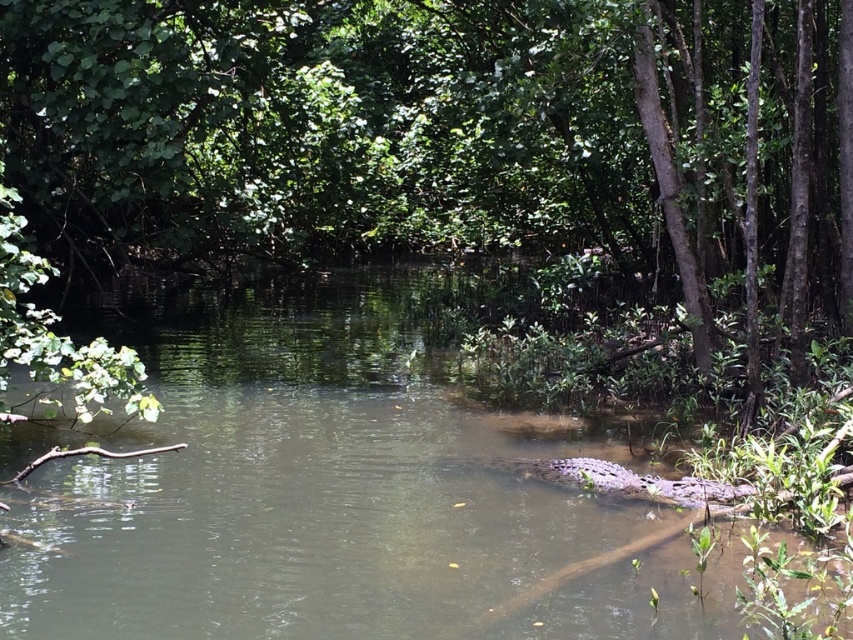
You are a bird flying over the swamp. You see the green leafy tree at center and the brown muddy stream at center. Which one is higher in the air?

The green leafy tree at center is higher in the air than the brown muddy stream at center because the tree is positioned above the stream in the scene.

You are standing in a swampy area and see a green leafy tree at center. You want to throw a stone to hit the tree. If your stone can travel 10 meters, will it reach the tree?

The green leafy tree at center is 9.21 meters away from the viewer. Since the stone can travel 10 meters, which is farther than 9.21 meters, the stone will reach the tree.

You are a hiker trying to cross the brown muddy stream at center. There is a green leafy tree at center nearby. Based on their widths, which one is wider?

The green leafy tree at center is wider than the brown muddy stream at center because the tree has a greater width as stated in the description.